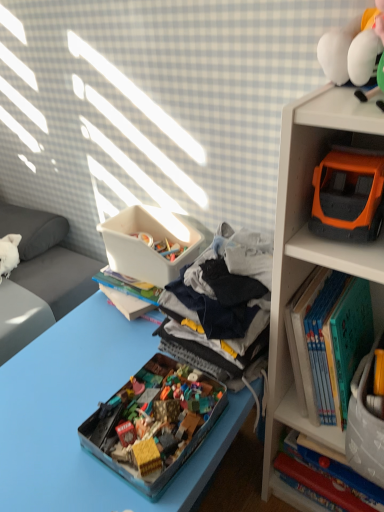
At what (x,y) coordinates should I click in order to perform the action: click on free space in front of white plastic container at center. Please return your answer as a coordinate pair (x, y). Looking at the image, I should click on (111, 341).